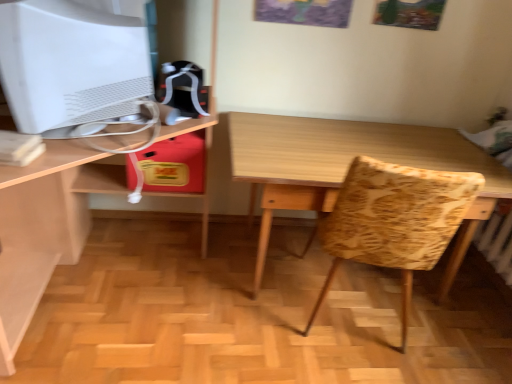
Image resolution: width=512 pixels, height=384 pixels. Find the location of `free point below wooden desk at center (from a real-world perspective)`. free point below wooden desk at center (from a real-world perspective) is located at coordinates (117, 283).